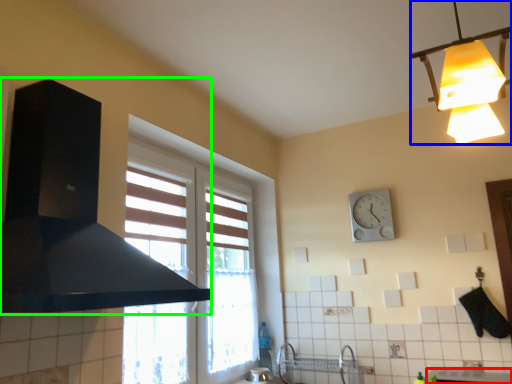
Question: Which object is positioned closest to counter top (highlighted by a red box)? Select from lamp (highlighted by a blue box) and exhaust hood (highlighted by a green box).

Choices:
 (A) lamp
 (B) exhaust hood

Answer: (A)